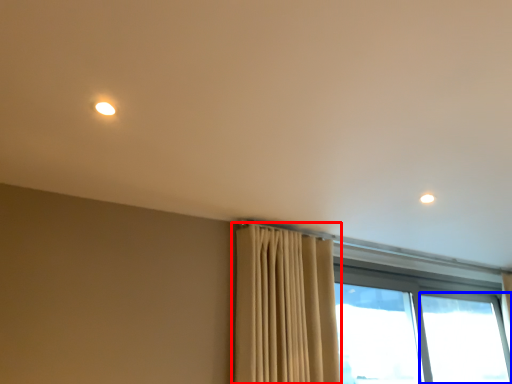
Question: Which object is further to the camera taking this photo, curtain (highlighted by a red box) or window (highlighted by a blue box)?

Choices:
 (A) curtain
 (B) window

Answer: (B)